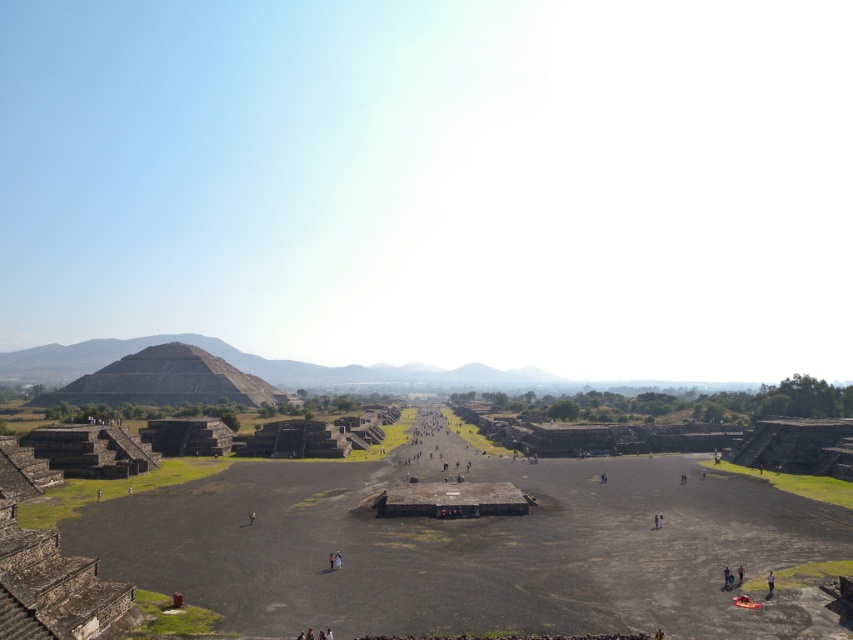
You are standing at the point marked as point (165, 380) in the archaeological site. What ancient structure is directly in front of you?

The gray stone pyramid at center left is located at point (165, 380), so the ancient structure directly in front of you is the gray stone pyramid at center left.